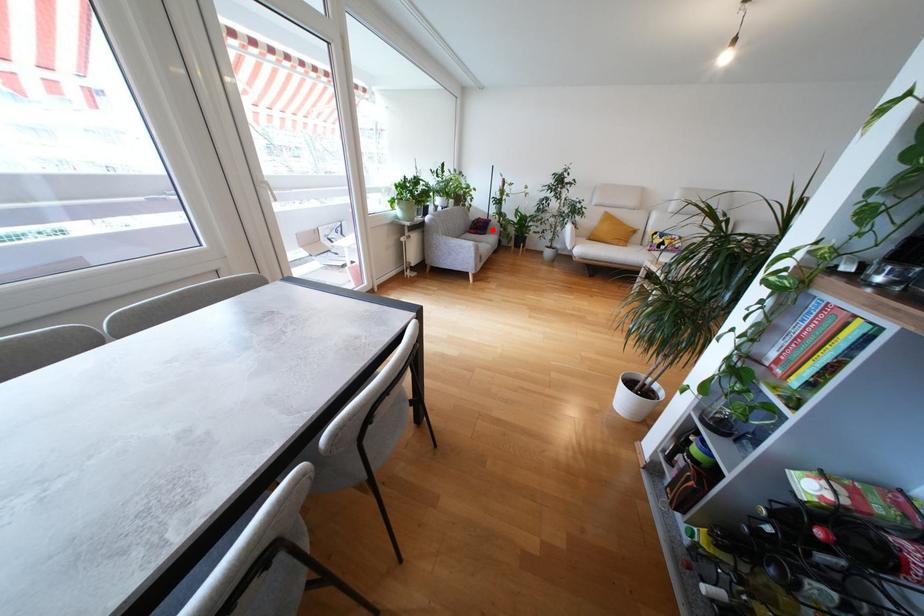
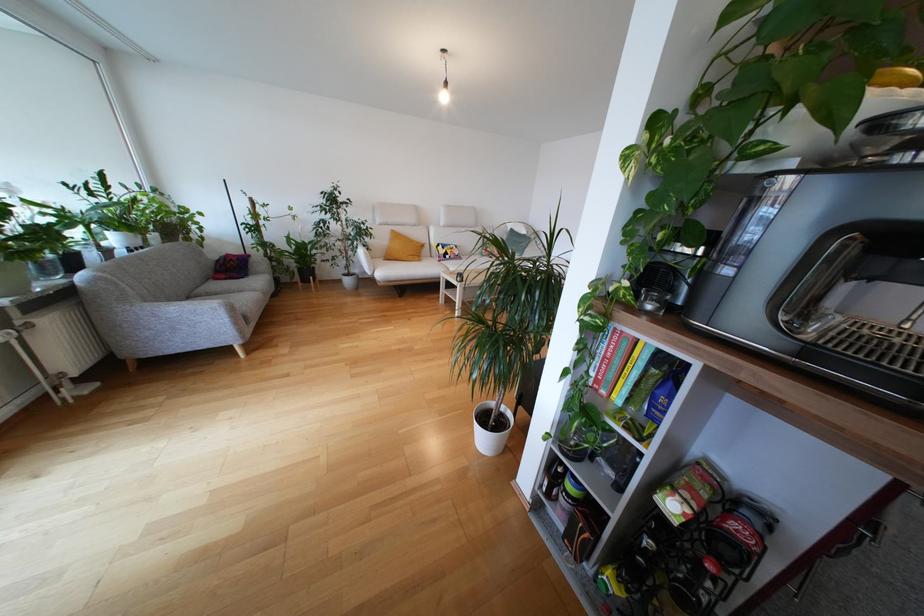
Locate, in the second image, the point that corresponds to the highlighted location in the first image.

(253, 268)